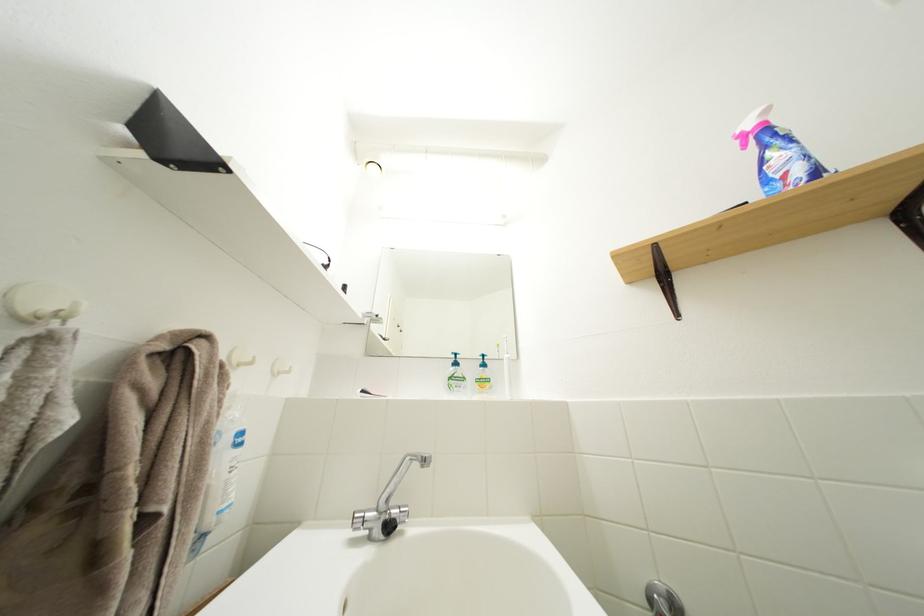
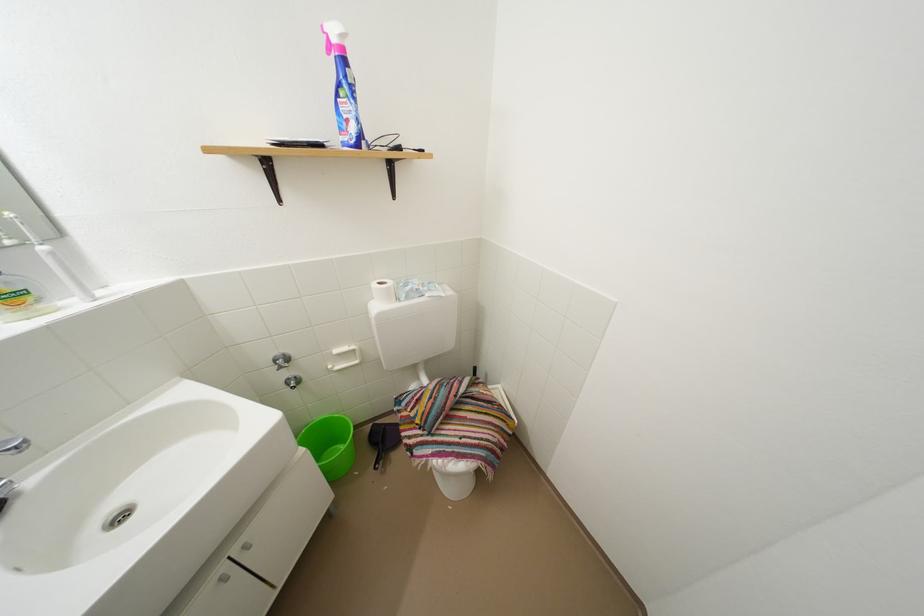
Where in the second image is the point corresponding to (759,135) from the first image?

(342, 45)